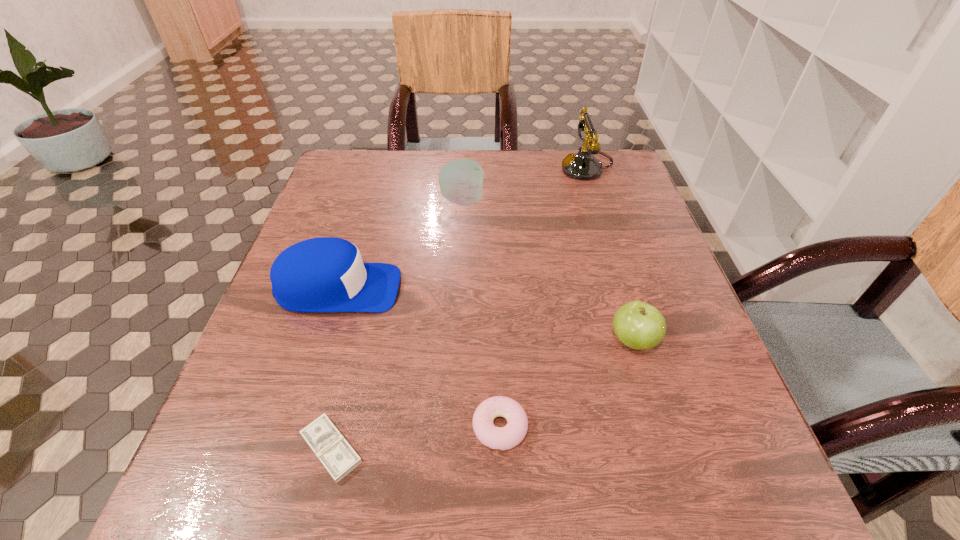
At what (x,y) coordinates should I click in order to perform the action: click on free space between the baseball cap and the doughnut. Please return your answer as a coordinate pair (x, y). This screenshot has height=540, width=960. Looking at the image, I should click on (420, 357).

You are a GUI agent. You are given a task and a screenshot of the screen. Output one action in this format:
    pyautogui.click(x=<x>, y=<y>)
    Task: Click on the free spot between the third farthest object and the money
    
    Given the screenshot: What is the action you would take?
    pyautogui.click(x=335, y=369)

Where is `free space between the fourth farthest object and the tallest object`? This screenshot has height=540, width=960. free space between the fourth farthest object and the tallest object is located at coordinates (610, 255).

In order to click on free spot between the fourth farthest object and the baseball cap in this screenshot , I will do (486, 315).

You are a GUI agent. You are given a task and a screenshot of the screen. Output one action in this format:
    pyautogui.click(x=<x>, y=<y>)
    Task: Click on the empty space between the doughnut and the shorter apple
    The image size is (960, 540).
    Given the screenshot: What is the action you would take?
    (x=566, y=384)

At what (x,y) coordinates should I click in order to perform the action: click on vacant space that's between the fifth tallest object and the right apple. Please return your answer as a coordinate pair (x, y). The width and height of the screenshot is (960, 540). Looking at the image, I should click on (566, 384).

Find the location of a particular element. free space between the fifth tallest object and the shortest object is located at coordinates (416, 438).

At what (x,y) coordinates should I click in order to perform the action: click on vacant space in between the right apple and the doughnut. Please return your answer as a coordinate pair (x, y). Looking at the image, I should click on point(566,384).

Image resolution: width=960 pixels, height=540 pixels. Identify the location of object that stands as the third closest to the money. (638, 325).

Where is `object that is the second closest to the doughnut`? object that is the second closest to the doughnut is located at coordinates (638, 325).